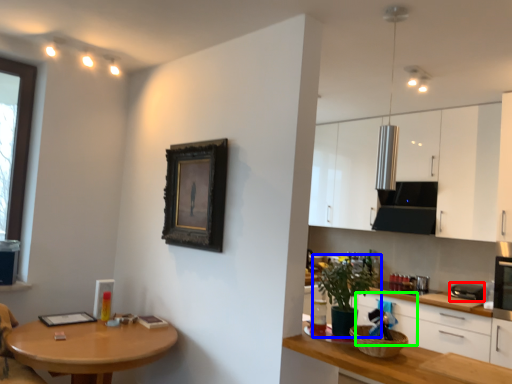
Question: Which object is positioned closest to appliance (highlighted by a red box)? Select from houseplant (highlighted by a blue box) and drawer (highlighted by a green box).

Choices:
 (A) houseplant
 (B) drawer

Answer: (B)